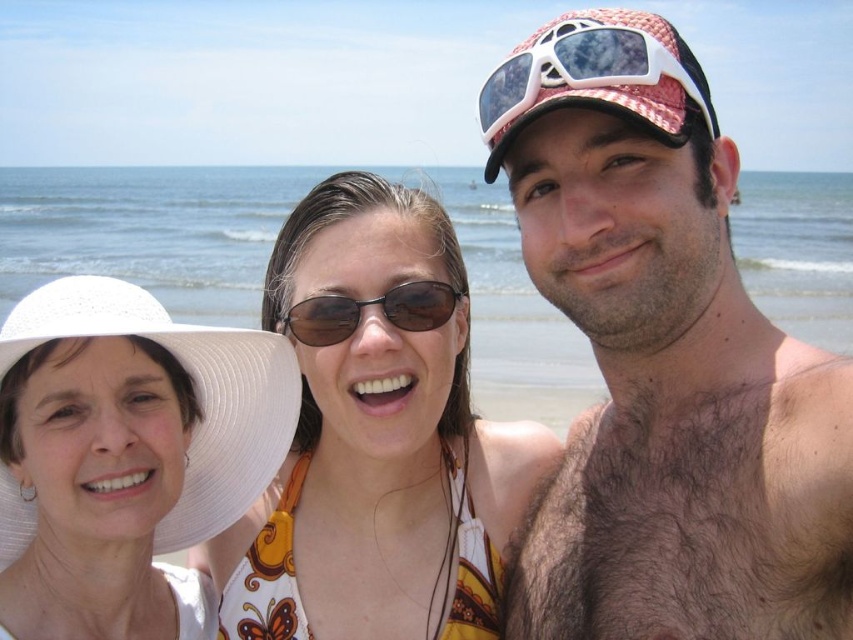
You are a photographer at the beach and want to ensure that both the brown floral bikini top at center and the black plastic sunglasses at center are clearly visible in your photo. Given their sizes, which object should you focus on to capture more details without zooming in?

The brown floral bikini top at center has a larger width than the black plastic sunglasses at center, so focusing on it would allow you to capture more details without needing to zoom in.

Based on the scene description, where is the brown floral bikini top at center located in the image?

The brown floral bikini top at center is located at point coordinates of 0.683 on the x axis and 0.443 on the y axis.